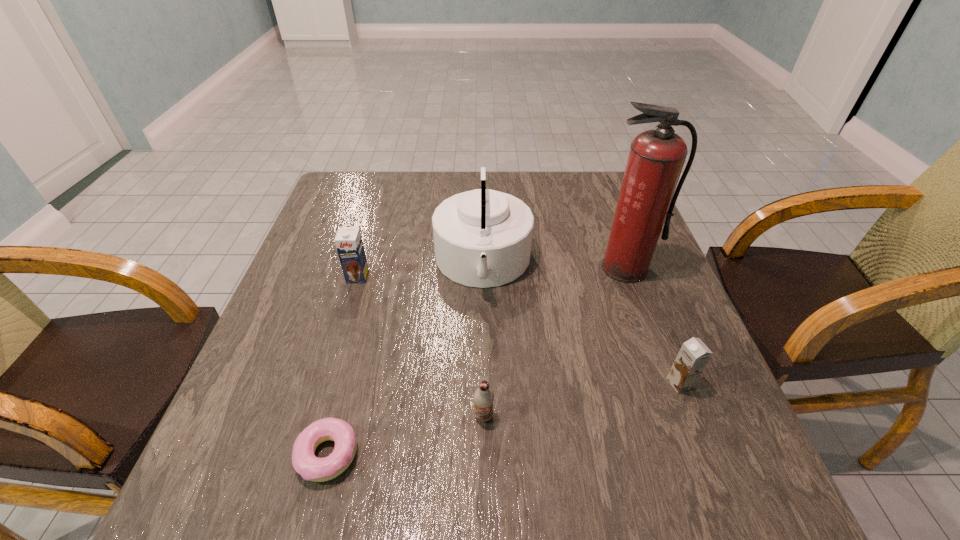
What are the coordinates of `doughnut situated at the left edge` in the screenshot? It's located at coord(305,463).

Image resolution: width=960 pixels, height=540 pixels. I want to click on fire extinguisher at the right edge, so click(646, 200).

Image resolution: width=960 pixels, height=540 pixels. In order to click on chocolate milk present at the right edge in this screenshot , I will do `click(694, 355)`.

Image resolution: width=960 pixels, height=540 pixels. I want to click on object at the near left corner, so click(x=305, y=463).

You are a GUI agent. You are given a task and a screenshot of the screen. Output one action in this format:
    pyautogui.click(x=<x>, y=<y>)
    Task: Click on the vacant space at the far edge of the desktop
    This screenshot has width=960, height=540.
    Given the screenshot: What is the action you would take?
    pyautogui.click(x=414, y=199)

Locate an element on the screen. vacant space at the near edge of the desktop is located at coordinates (551, 478).

Identify the location of free region at the left edge of the desktop. This screenshot has width=960, height=540. (333, 314).

In the image, there is a desktop. Where is `vacant region at the right edge`? This screenshot has width=960, height=540. vacant region at the right edge is located at coordinates (659, 329).

You are a GUI agent. You are given a task and a screenshot of the screen. Output one action in this format:
    pyautogui.click(x=<x>, y=<y>)
    Task: Click on the free space at the far left corner of the desktop
    Image resolution: width=960 pixels, height=540 pixels.
    Given the screenshot: What is the action you would take?
    pyautogui.click(x=375, y=199)

Find the location of a particular element. free space at the far right corner of the desktop is located at coordinates (608, 189).